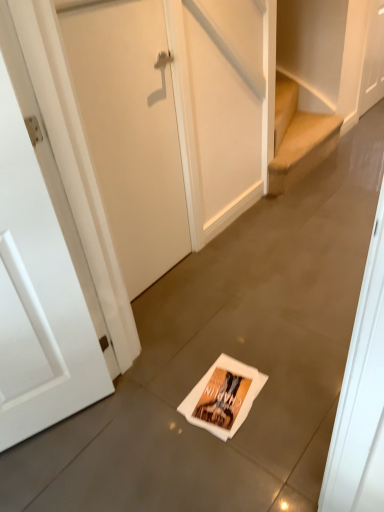
Question: Which direction should I rotate to look at white matte door at center, the second door in the right-to-left sequence?

Choices:
 (A) right
 (B) left

Answer: (B)

Question: Considering the relative positions of white matte door at upper right, the third door viewed from the left, and white paper flyer at center in the image provided, is white matte door at upper right, the third door viewed from the left, to the right of white paper flyer at center from the viewer's perspective?

Choices:
 (A) no
 (B) yes

Answer: (B)

Question: Is white paper flyer at center at the back of white matte door at upper right, acting as the 3th door starting from the bottom?

Choices:
 (A) no
 (B) yes

Answer: (A)

Question: Is white matte door at upper right, which is the third door from front to back, smaller than white paper flyer at center?

Choices:
 (A) yes
 (B) no

Answer: (B)

Question: Considering the relative positions of white matte door at upper right, which appears as the first door when viewed from the right, and white paper flyer at center in the image provided, is white matte door at upper right, which appears as the first door when viewed from the right, to the left of white paper flyer at center from the viewer's perspective?

Choices:
 (A) no
 (B) yes

Answer: (A)

Question: Considering the relative positions of white matte door at upper right, the 1th door when ordered from back to front, and white paper flyer at center in the image provided, is white matte door at upper right, the 1th door when ordered from back to front, behind white paper flyer at center?

Choices:
 (A) yes
 (B) no

Answer: (A)

Question: Does white matte door at upper right, which appears as the first door when viewed from the right, have a greater width compared to white paper flyer at center?

Choices:
 (A) no
 (B) yes

Answer: (A)

Question: Is white matte door at upper right, which is the third door from front to back, outside of white matte door at left, the third door positioned from the back?

Choices:
 (A) no
 (B) yes

Answer: (B)

Question: From a real-world perspective, is white matte door at upper right, the third door viewed from the left, beneath white matte door at left, the third door positioned from the back?

Choices:
 (A) no
 (B) yes

Answer: (B)

Question: Can you confirm if white matte door at upper right, which appears as the first door when viewed from the right, is thinner than white matte door at left, arranged as the third door when viewed from the right?

Choices:
 (A) no
 (B) yes

Answer: (A)

Question: Does white matte door at upper right, the 1th door when ordered from back to front, have a lesser height compared to white matte door at left, which is counted as the 1th door, starting from the bottom?

Choices:
 (A) yes
 (B) no

Answer: (A)

Question: From the image's perspective, would you say white matte door at upper right, acting as the 3th door starting from the bottom, is shown under white matte door at left, marked as the 1th door in a left-to-right arrangement?

Choices:
 (A) yes
 (B) no

Answer: (B)

Question: Can you confirm if white matte door at upper right, acting as the 3th door starting from the bottom, is bigger than white matte door at left, arranged as the third door when viewed from the right?

Choices:
 (A) yes
 (B) no

Answer: (A)

Question: From a real-world perspective, does white matte door at center, the second door in the front-to-back sequence, stand above white matte door at left, which is counted as the 1th door, starting from the bottom?

Choices:
 (A) no
 (B) yes

Answer: (B)